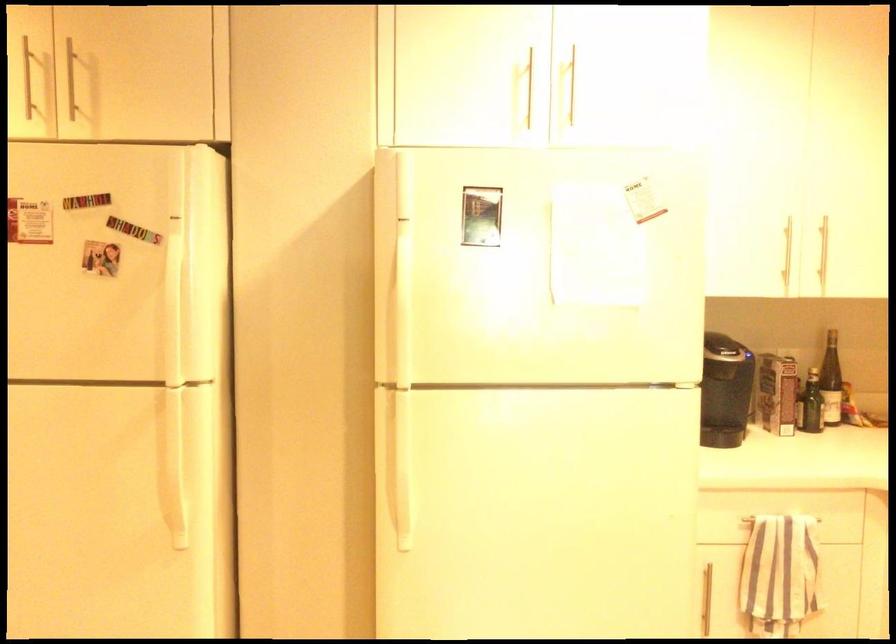
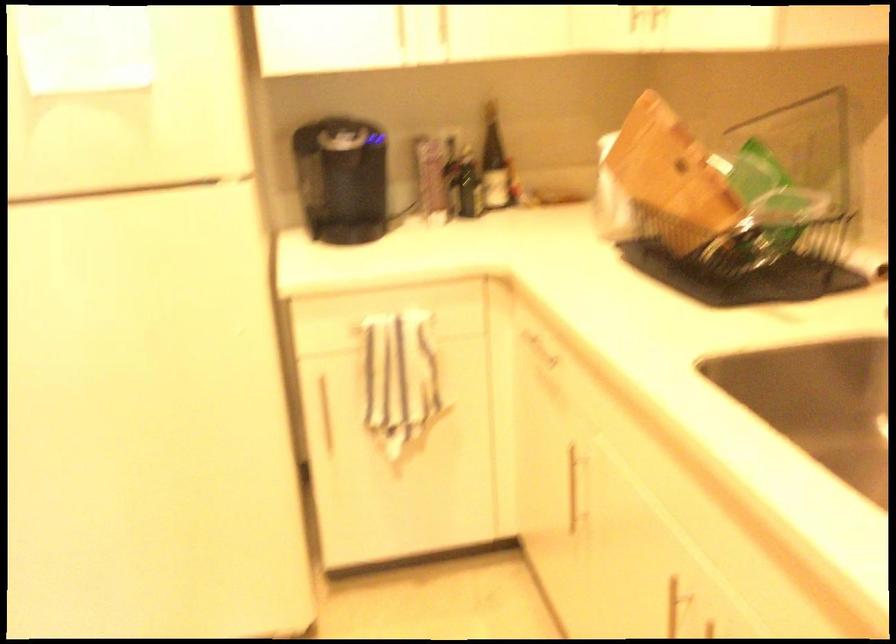
Question: Based on the continuous images, in which direction is the camera rotating? Reply with the corresponding letter.

Choices:
 (A) Left
 (B) Right
 (C) Up
 (D) Down

Answer: (D)